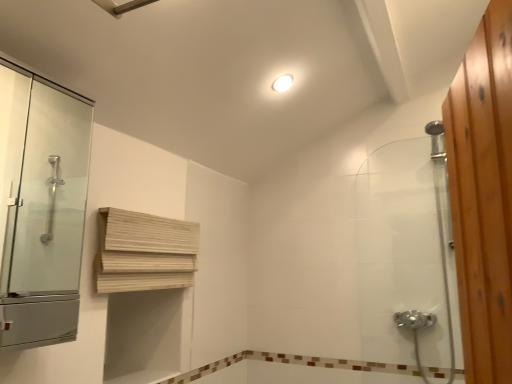
Question: Is light wood/wooden shelf at upper center taller or shorter than brown mosaic tile at lower center?

Choices:
 (A) short
 (B) tall

Answer: (B)

Question: Relative to brown mosaic tile at lower center, is light wood/wooden shelf at upper center in front or behind?

Choices:
 (A) behind
 (B) front

Answer: (B)

Question: Estimate the real-world distances between objects in this image. Which object is closer to the white glossy light fixture at upper center?

Choices:
 (A) light wood/wooden shelf at upper center
 (B) transparent glass shower door at left
 (C) brown mosaic tile at lower center
 (D) clear glass shower door at right

Answer: (A)

Question: Considering the real-world distances, which object is closest to the transparent glass shower door at left?

Choices:
 (A) light wood/wooden shelf at upper center
 (B) brown mosaic tile at lower center
 (C) white glossy light fixture at upper center
 (D) clear glass shower door at right

Answer: (A)